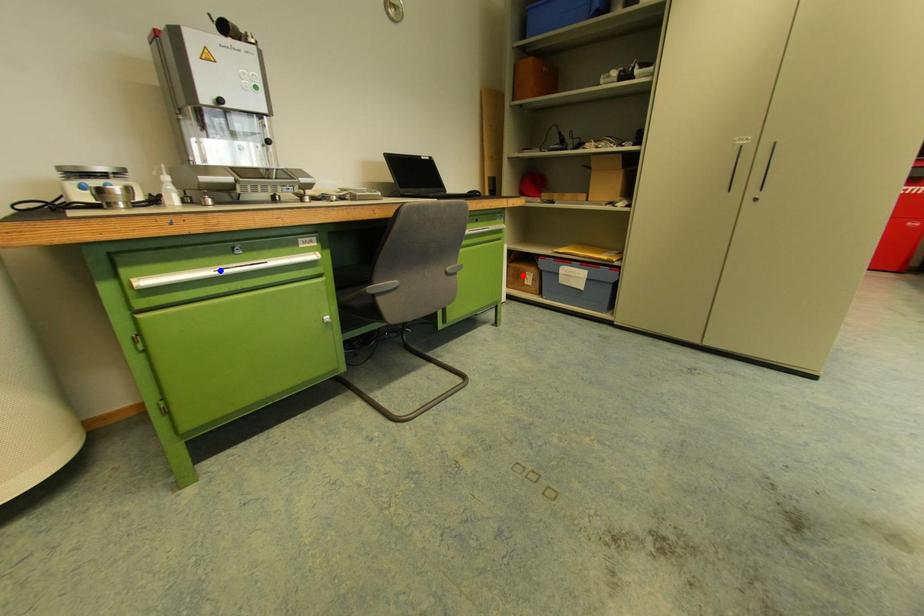
Question: Two points are marked on the image. Which point is closer to the camera?

Choices:
 (A) Blue point is closer.
 (B) Red point is closer.

Answer: (A)